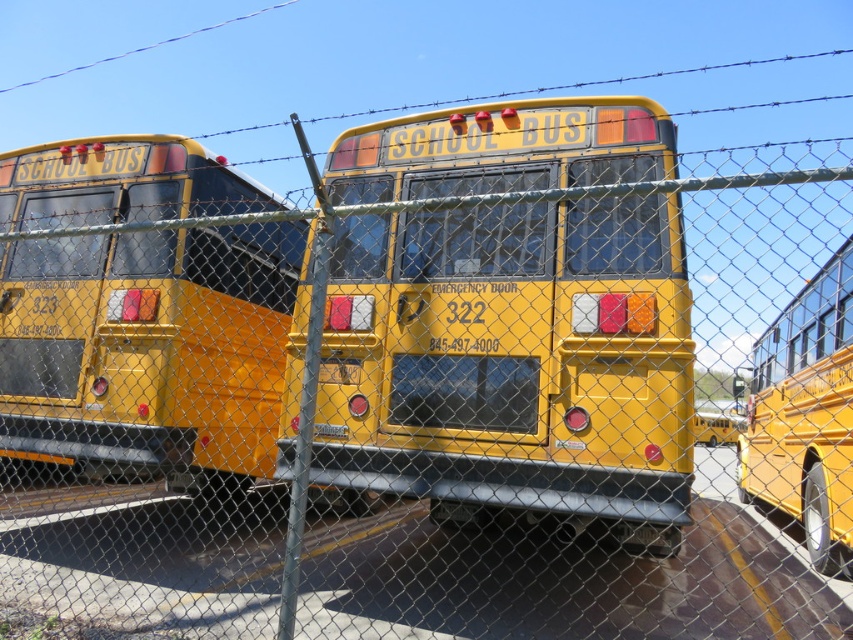
Locate an element on the screen. This screenshot has height=640, width=853. yellow matte school bus at center is located at coordinates (514, 365).

Is yellow matte school bus at center taller than matte yellow school bus at left?

Incorrect, yellow matte school bus at center's height is not larger of matte yellow school bus at left's.

Who is more distant from viewer, (438, 310) or (129, 172)?

The point (129, 172) is more distant.

Find the location of a particular element. The width and height of the screenshot is (853, 640). yellow matte school bus at center is located at coordinates (514, 365).

Can you confirm if matte yellow school bus at left is shorter than matte yellow school bus at right?

No, matte yellow school bus at left is not shorter than matte yellow school bus at right.

Describe the element at coordinates (144, 355) in the screenshot. The width and height of the screenshot is (853, 640). I see `matte yellow school bus at left` at that location.

Identify the location of matte yellow school bus at left. Image resolution: width=853 pixels, height=640 pixels. click(144, 355).